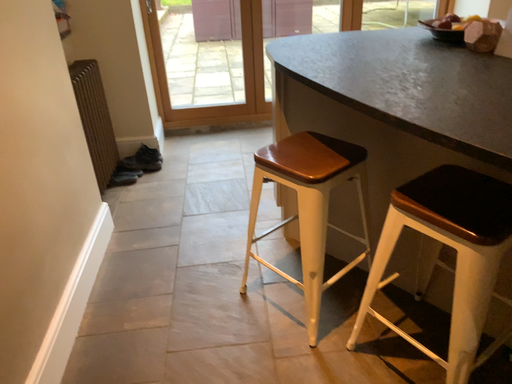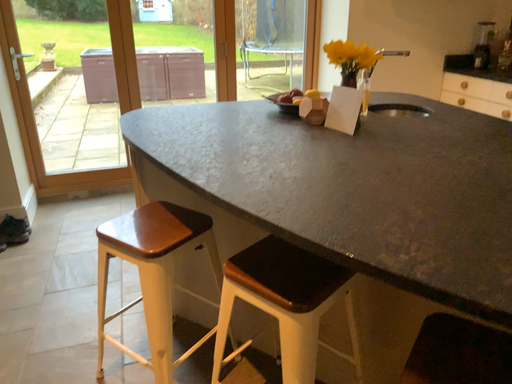
Question: How did the camera likely rotate when shooting the video?

Choices:
 (A) rotated upward
 (B) rotated downward

Answer: (A)